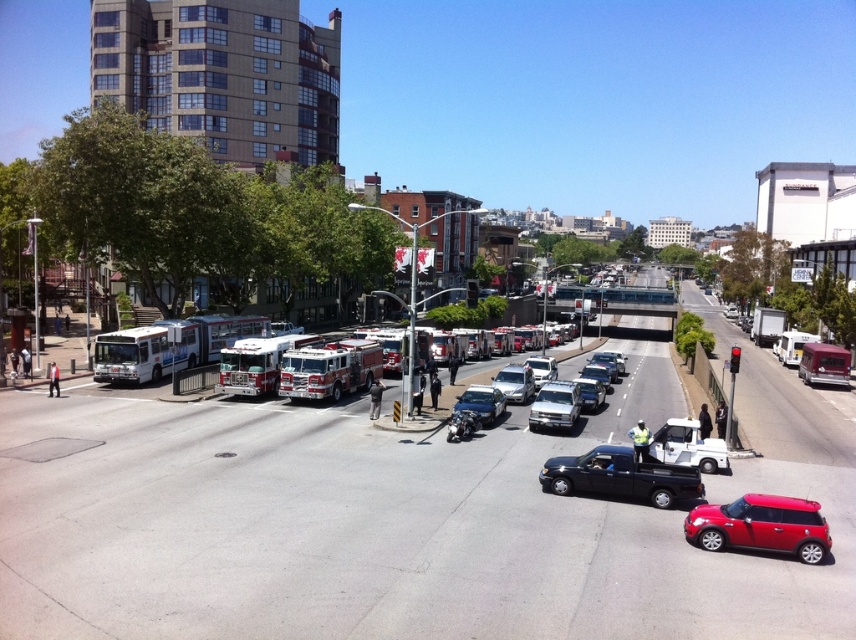
Question: Which is nearer to the red and white metallic fire truck at center-left?

Choices:
 (A) shiny silver fire truck at left
 (B) white matte truck at center

Answer: (A)

Question: Where is shiny silver fire truck at left located in relation to matte white truck at center in the image?

Choices:
 (A) above
 (B) below

Answer: (A)

Question: Among these objects, which one is farthest from the camera?

Choices:
 (A) white matte truck at center
 (B) red metallic fire truck at center
 (C) metallic silver car at center

Answer: (A)

Question: Can you confirm if black matte truck at center is smaller than matte white truck at center?

Choices:
 (A) yes
 (B) no

Answer: (B)

Question: Which point appears closest to the camera in this image?

Choices:
 (A) (563, 472)
 (B) (508, 380)
 (C) (159, 346)

Answer: (A)

Question: Can you confirm if red and white metallic fire truck at center-left is positioned to the right of matte white truck at center?

Choices:
 (A) no
 (B) yes

Answer: (A)